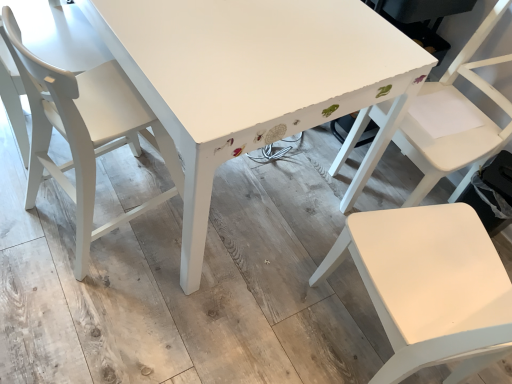
Find the location of `vacant space that is to the left of white matte chair at right, marked as the 2th chair in a left-to-right arrangement`. vacant space that is to the left of white matte chair at right, marked as the 2th chair in a left-to-right arrangement is located at coordinates (260, 316).